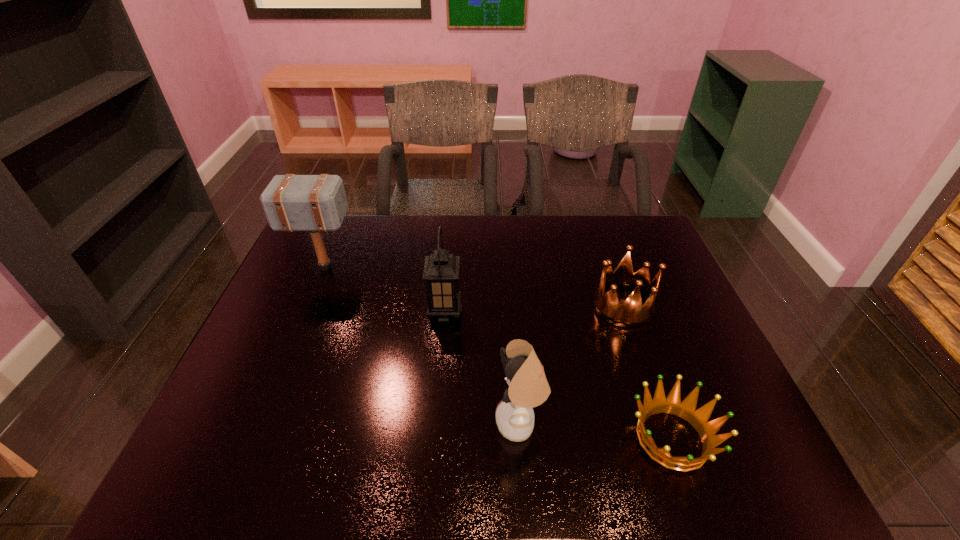
Where is `vacant space situated at the front face of the doll`? This screenshot has width=960, height=540. vacant space situated at the front face of the doll is located at coordinates (333, 423).

This screenshot has height=540, width=960. Find the location of `free spot located at the front face of the doll`. free spot located at the front face of the doll is located at coordinates (320, 423).

Image resolution: width=960 pixels, height=540 pixels. I want to click on free spot located 0.210m at the front face of the doll, so click(401, 423).

Identify the location of free space located 0.230m on the back of the farther crown. (600, 241).

Find the location of a particular element. This screenshot has height=540, width=960. vacant position located on the left of the nearer crown is located at coordinates (575, 438).

You are a GUI agent. You are given a task and a screenshot of the screen. Output one action in this format:
    pyautogui.click(x=<x>, y=<y>)
    Task: Click on the object positioned at the far edge
    The height and width of the screenshot is (540, 960).
    Given the screenshot: What is the action you would take?
    pyautogui.click(x=315, y=203)

Identify the location of doll present at the near edge. (528, 387).

You are a GUI agent. You are given a task and a screenshot of the screen. Output one action in this format:
    pyautogui.click(x=<x>, y=<y>)
    Task: Click on the crown present at the near edge
    
    Given the screenshot: What is the action you would take?
    pyautogui.click(x=686, y=409)

Locate an element on the screen. object situated at the left edge is located at coordinates (315, 203).

The image size is (960, 540). What are the coordinates of `object at the far left corner` in the screenshot? It's located at (315, 203).